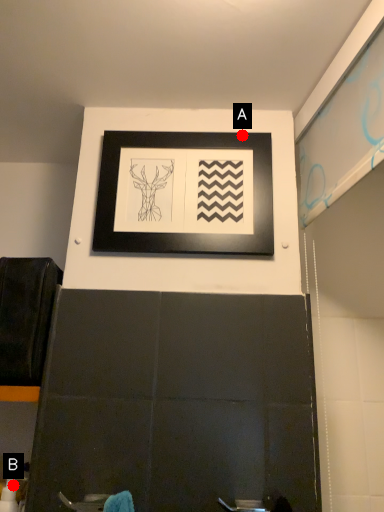
Question: Two points are circled on the image, labeled by A and B beside each circle. Which point is closer to the camera?

Choices:
 (A) A is closer
 (B) B is closer

Answer: (B)